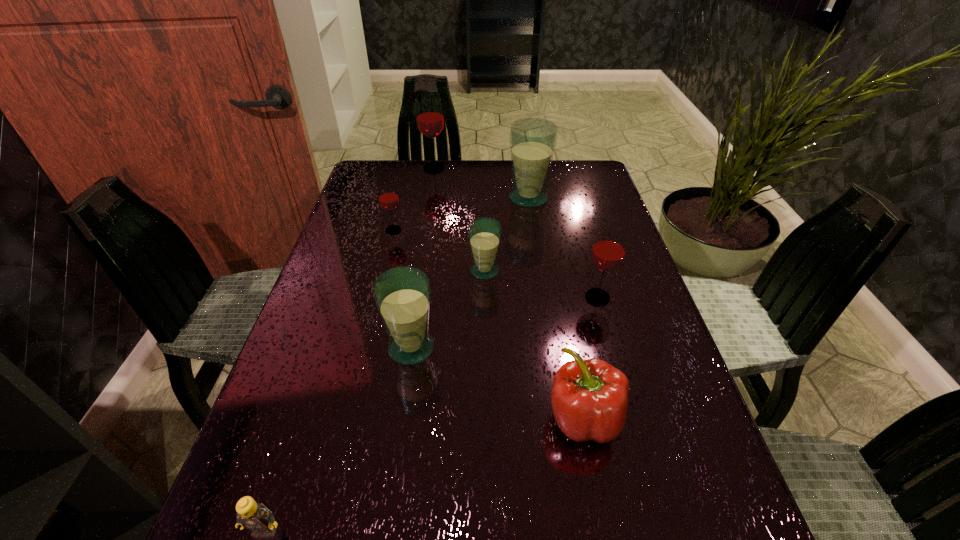
Locate an element on the screen. the second object from left to right is located at coordinates (388, 198).

In order to click on the fourth nearest glass in this screenshot , I will do `click(388, 198)`.

Identify the location of pepper. This screenshot has width=960, height=540. (589, 398).

The image size is (960, 540). Find the location of `pink pepper`. pink pepper is located at coordinates (589, 398).

I want to click on the leftmost object, so click(257, 518).

Where is `Lego`? The width and height of the screenshot is (960, 540). Lego is located at coordinates (257, 518).

Locate an element on the screen. free location located on the front of the farthest object is located at coordinates (431, 188).

The height and width of the screenshot is (540, 960). Find the location of `vacant point located 0.170m on the front of the fifth glass from left to right`. vacant point located 0.170m on the front of the fifth glass from left to right is located at coordinates (536, 246).

You are a GUI agent. You are given a task and a screenshot of the screen. Output one action in this format:
    pyautogui.click(x=<x>, y=<y>)
    Task: Click on the vacant area situated on the back of the second biggest red glass
    This screenshot has height=540, width=960.
    Given the screenshot: What is the action you would take?
    570,201

The image size is (960, 540). Find the location of `vacant space situated on the back of the nearest blue glass`. vacant space situated on the back of the nearest blue glass is located at coordinates (429, 227).